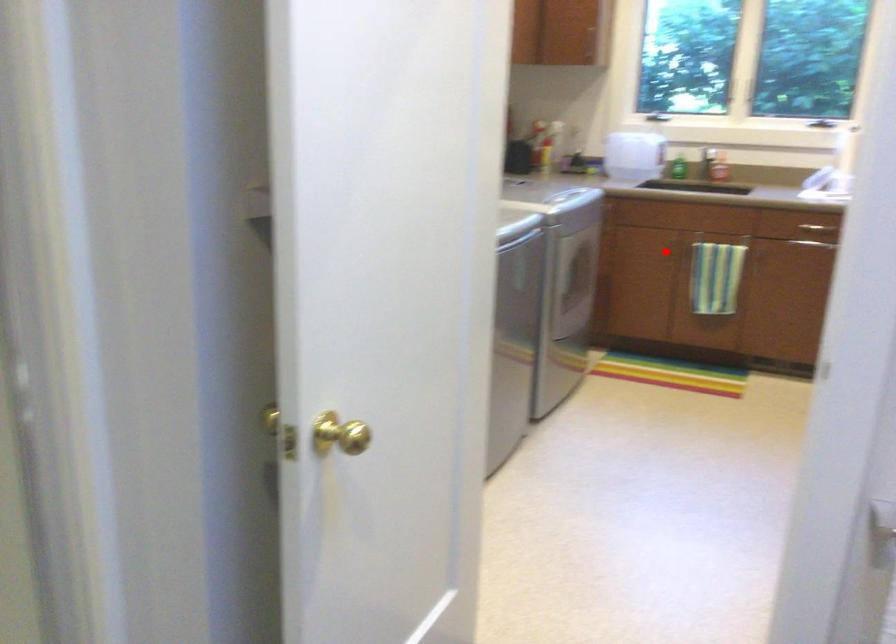
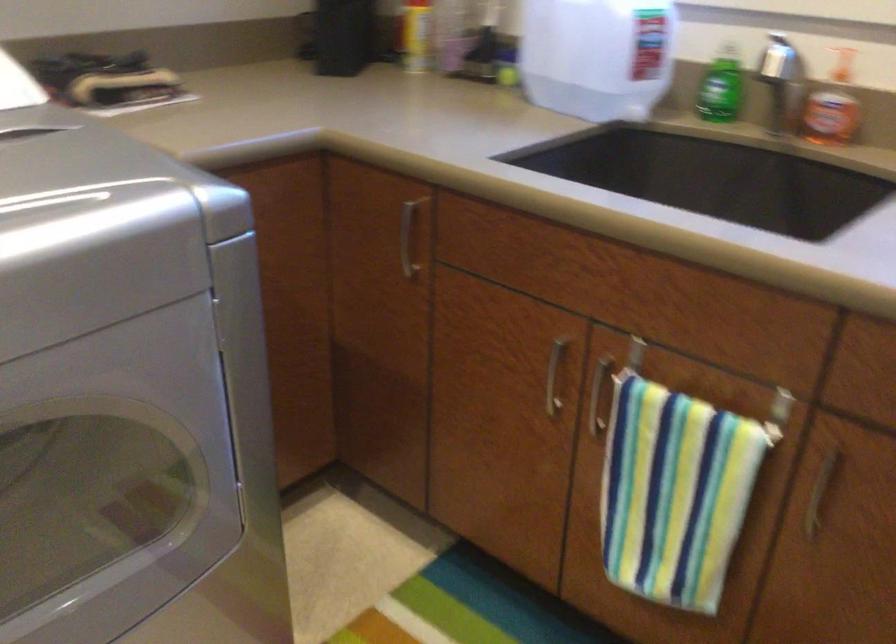
Find the pixel in the second image that matches the highlighted location in the first image.

(554, 375)